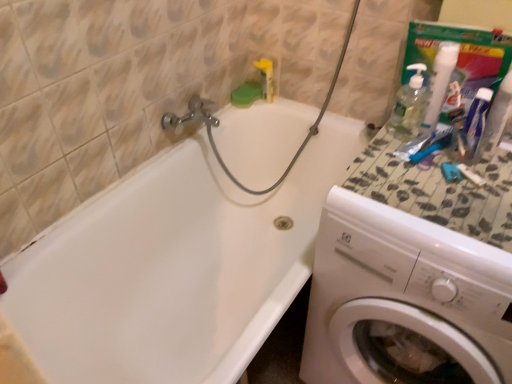
Where is `spots to the right of yellow plastic toothbrush at upper center`? spots to the right of yellow plastic toothbrush at upper center is located at coordinates (295, 105).